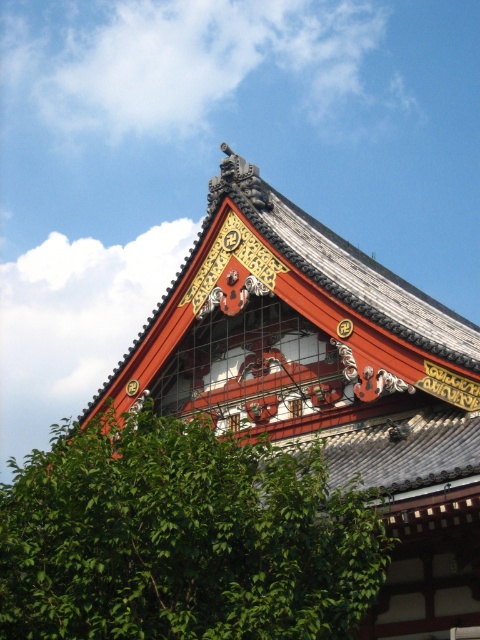
What is the position of the green leafy tree at lower left relative to the shiny red wood roof at upper center?

The green leafy tree at lower left is positioned to the left of the shiny red wood roof at upper center.

You are a visitor standing in front of the traditional Japanese building. You notice the green leafy tree at lower left and the shiny red wood roof at upper center. Which object appears taller in the scene?

The shiny red wood roof at upper center appears taller than the green leafy tree at lower left.

You are standing in front of the traditional Japanese building and notice a green leafy tree at lower left and a shiny red wood roof at upper center. Which object is located higher up in the scene?

The shiny red wood roof at upper center is located higher up in the scene than the green leafy tree at lower left.